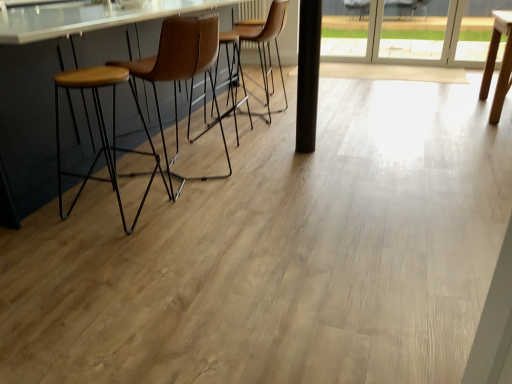
Question: Would you say brown leather chair at center, the 1th chair from the back, is outside wooden seat stool at left?

Choices:
 (A) yes
 (B) no

Answer: (A)

Question: Considering the relative sizes of brown leather chair at center, the 1th chair from the back, and wooden seat stool at left in the image provided, is brown leather chair at center, the 1th chair from the back, smaller than wooden seat stool at left?

Choices:
 (A) no
 (B) yes

Answer: (A)

Question: Is wooden seat stool at left inside brown leather chair at center, the 1th chair from the back?

Choices:
 (A) no
 (B) yes

Answer: (A)

Question: Is brown leather chair at center, the 1th chair from the back, oriented towards wooden seat stool at left?

Choices:
 (A) no
 (B) yes

Answer: (A)

Question: Is brown leather chair at center, which is the second chair in front-to-back order, looking in the opposite direction of wooden seat stool at left?

Choices:
 (A) yes
 (B) no

Answer: (B)

Question: Looking at the image, does transparent glass screen door at upper right seem bigger or smaller compared to black matte pole at center?

Choices:
 (A) small
 (B) big

Answer: (B)

Question: Does point (437, 38) appear closer or farther from the camera than point (312, 112)?

Choices:
 (A) farther
 (B) closer

Answer: (A)

Question: In terms of width, does transparent glass screen door at upper right look wider or thinner when compared to black matte pole at center?

Choices:
 (A) thin
 (B) wide

Answer: (A)

Question: Do you think transparent glass screen door at upper right is within black matte pole at center, or outside of it?

Choices:
 (A) inside
 (B) outside

Answer: (B)

Question: Is transparent glass screen door at upper right taller or shorter than brown leather stool at left, the second chair viewed from the back?

Choices:
 (A) tall
 (B) short

Answer: (B)

Question: In the image, is transparent glass screen door at upper right positioned in front of or behind brown leather stool at left, the first chair when ordered from front to back?

Choices:
 (A) behind
 (B) front

Answer: (A)

Question: Is transparent glass screen door at upper right to the left or to the right of brown leather stool at left, the second chair viewed from the back, in the image?

Choices:
 (A) right
 (B) left

Answer: (A)

Question: Is transparent glass screen door at upper right spatially inside brown leather stool at left, the second chair viewed from the back, or outside of it?

Choices:
 (A) outside
 (B) inside

Answer: (A)

Question: From a real-world perspective, is black matte pole at center physically located above or below brown leather stool at left, the first chair when ordered from front to back?

Choices:
 (A) below
 (B) above

Answer: (B)

Question: Looking at the image, does black matte pole at center seem bigger or smaller compared to brown leather stool at left, the second chair viewed from the back?

Choices:
 (A) small
 (B) big

Answer: (A)